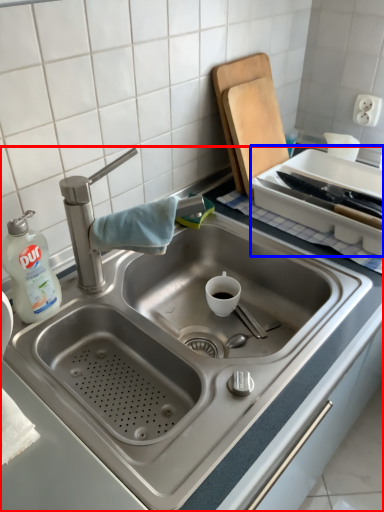
Question: Which object is closer to the camera taking this photo, sink (highlighted by a red box) or appliance (highlighted by a blue box)?

Choices:
 (A) sink
 (B) appliance

Answer: (A)